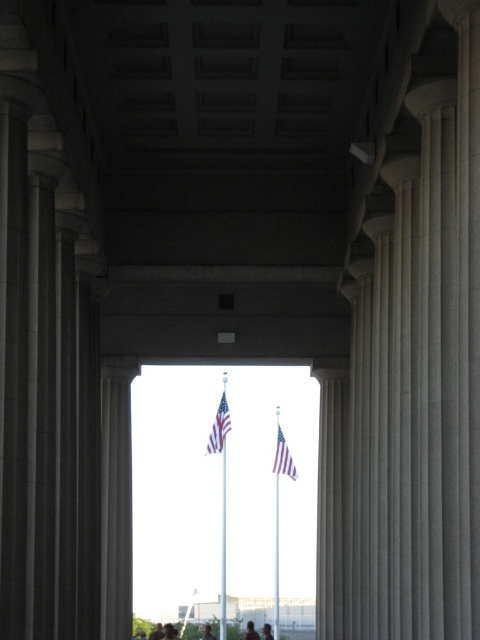
Question: Which point appears farthest from the camera in this image?

Choices:
 (A) (155, 627)
 (B) (247, 637)

Answer: (A)

Question: Does american flag at center come behind dark hair at center?

Choices:
 (A) yes
 (B) no

Answer: (B)

Question: Estimate the real-world distances between objects in this image. Which object is farther from the smooth skin person at center?

Choices:
 (A) dark hair at center
 (B) polished metal flag pole at center
 (C) light brown hair at center
 (D) american flag at center

Answer: (D)

Question: Is metallic silver flag pole at center positioned in front of dark hair at center?

Choices:
 (A) yes
 (B) no

Answer: (A)

Question: Is polished metal flag pole at center smaller than light brown hair at center?

Choices:
 (A) no
 (B) yes

Answer: (A)

Question: Which object is positioned farthest from the metallic silver flag pole at center?

Choices:
 (A) white fabric flag at center
 (B) blurred hair at center
 (C) dark hair at center
 (D) light brown hair at center

Answer: (D)